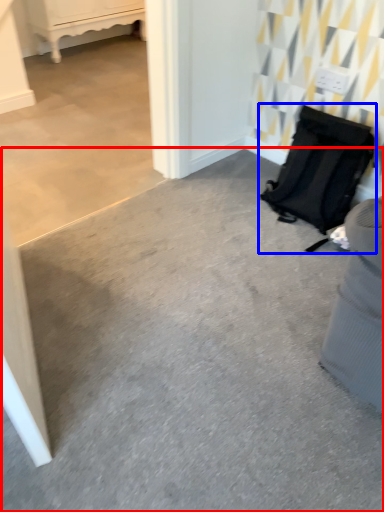
Question: Which point is closer to the camera, concrete (highlighted by a red box) or luggage and bags (highlighted by a blue box)?

Choices:
 (A) concrete
 (B) luggage and bags

Answer: (A)